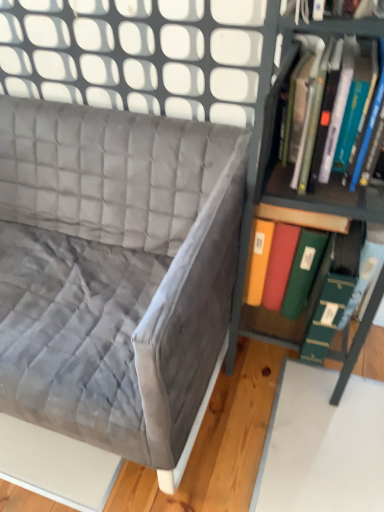
Question: Should I look upward or downward to see green matte folder at right, acting as the first book starting from the bottom?

Choices:
 (A) up
 (B) down

Answer: (B)

Question: Should I look upward or downward to see hardcover book at right, the second book in the bottom-to-top sequence?

Choices:
 (A) up
 (B) down

Answer: (A)

Question: From a real-world perspective, is hardcover book at right, which ranks as the first book in top-to-bottom order, positioned under velvet gray couch at upper left based on gravity?

Choices:
 (A) no
 (B) yes

Answer: (A)

Question: Does hardcover book at right, the second book in the bottom-to-top sequence, appear on the left side of velvet gray couch at upper left?

Choices:
 (A) yes
 (B) no

Answer: (B)

Question: Can you confirm if hardcover book at right, which ranks as the first book in top-to-bottom order, is taller than velvet gray couch at upper left?

Choices:
 (A) yes
 (B) no

Answer: (B)

Question: Can we say hardcover book at right, which ranks as the first book in top-to-bottom order, lies outside velvet gray couch at upper left?

Choices:
 (A) no
 (B) yes

Answer: (B)

Question: Is hardcover book at right, the second book in the bottom-to-top sequence, positioned with its back to velvet gray couch at upper left?

Choices:
 (A) no
 (B) yes

Answer: (A)

Question: Does hardcover book at right, the second book in the bottom-to-top sequence, lie behind velvet gray couch at upper left?

Choices:
 (A) no
 (B) yes

Answer: (B)

Question: Does velvet gray couch at upper left lie behind metallic green bookshelf at right?

Choices:
 (A) no
 (B) yes

Answer: (B)

Question: Is velvet gray couch at upper left outside metallic green bookshelf at right?

Choices:
 (A) no
 (B) yes

Answer: (B)

Question: From a real-world perspective, is velvet gray couch at upper left located higher than metallic green bookshelf at right?

Choices:
 (A) yes
 (B) no

Answer: (B)

Question: Is velvet gray couch at upper left positioned far away from metallic green bookshelf at right?

Choices:
 (A) no
 (B) yes

Answer: (A)

Question: From the image's perspective, is velvet gray couch at upper left above metallic green bookshelf at right?

Choices:
 (A) no
 (B) yes

Answer: (A)

Question: Can you confirm if velvet gray couch at upper left is wider than metallic green bookshelf at right?

Choices:
 (A) yes
 (B) no

Answer: (A)

Question: Is green matte folder at right, the second book viewed from the top, behind hardcover book at right, which ranks as the first book in top-to-bottom order?

Choices:
 (A) no
 (B) yes

Answer: (B)